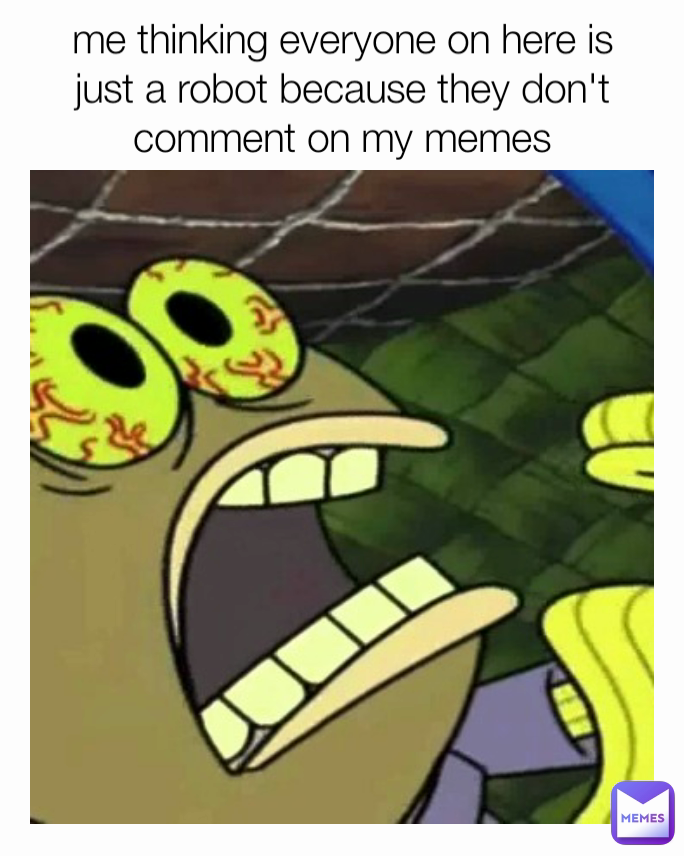
What are the coordinates of `ceiling` in the screenshot? It's located at (327, 241).